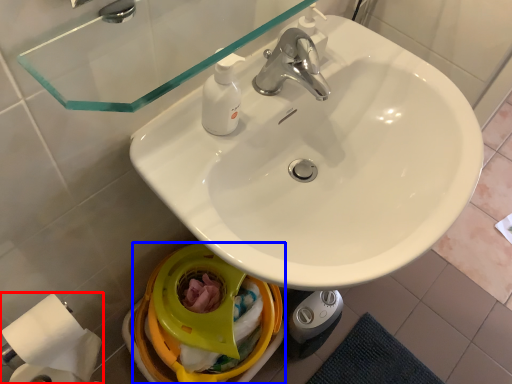
Question: Among these objects, which one is nearest to the camera, toilet paper (highlighted by a red box) or bidet (highlighted by a blue box)?

Choices:
 (A) toilet paper
 (B) bidet

Answer: (A)